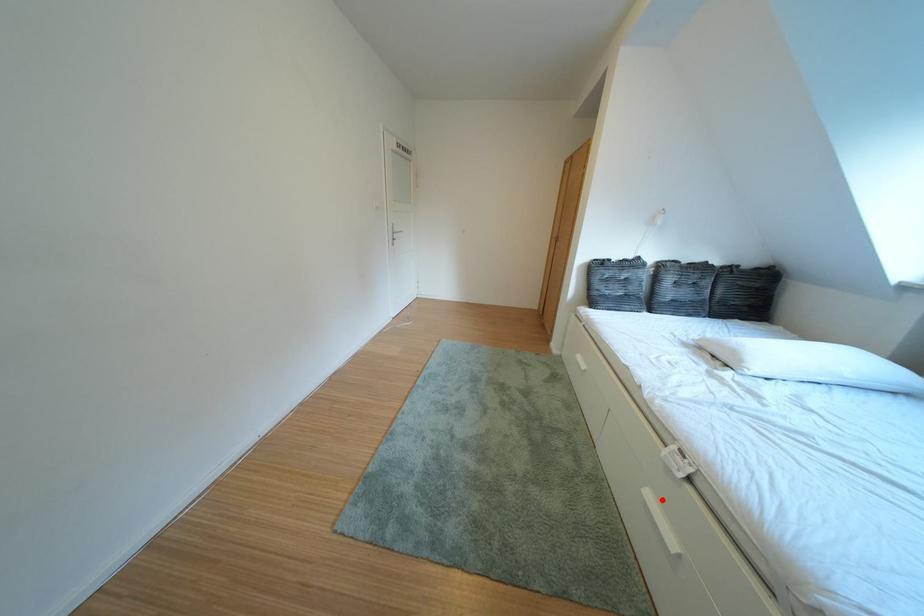
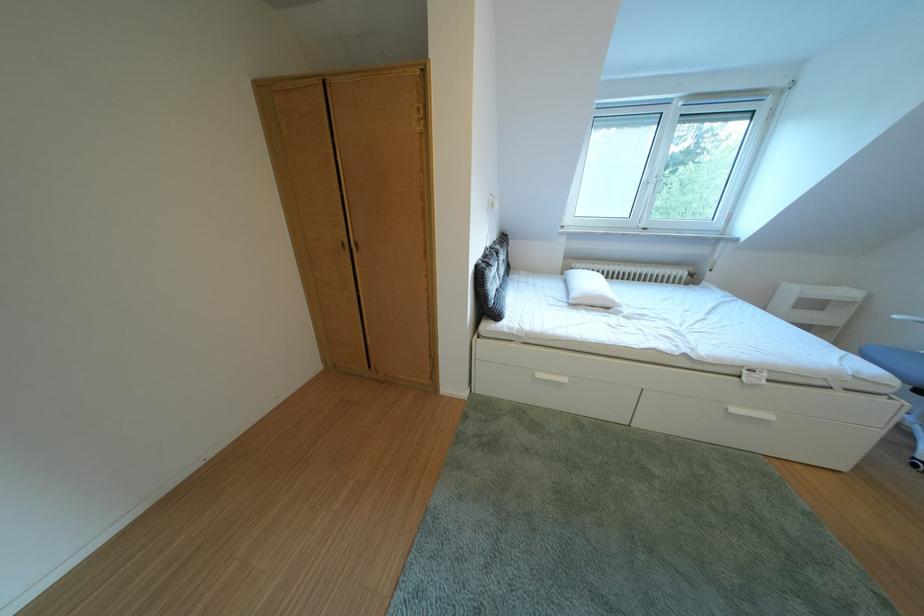
In the second image, find the point that corresponds to the highlighted location in the first image.

(748, 415)